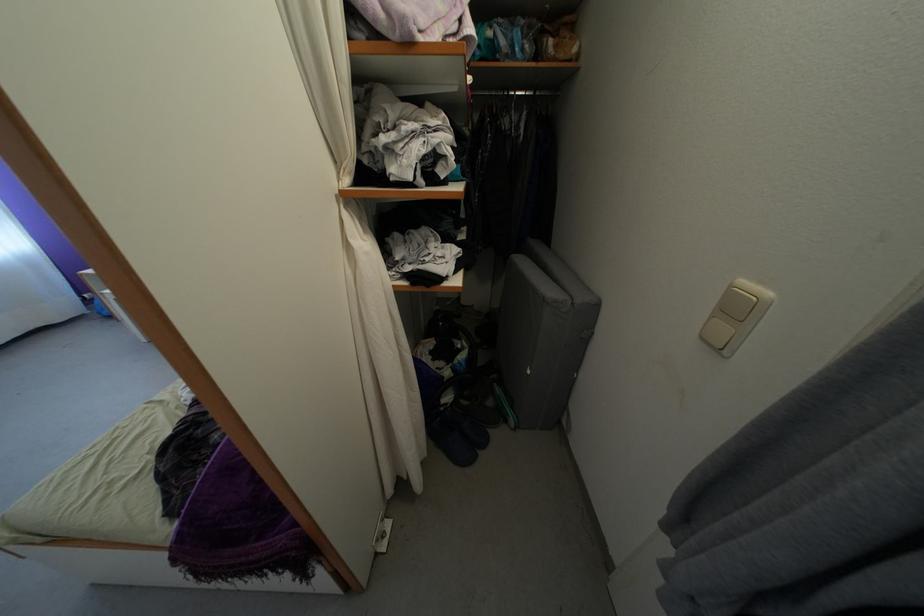
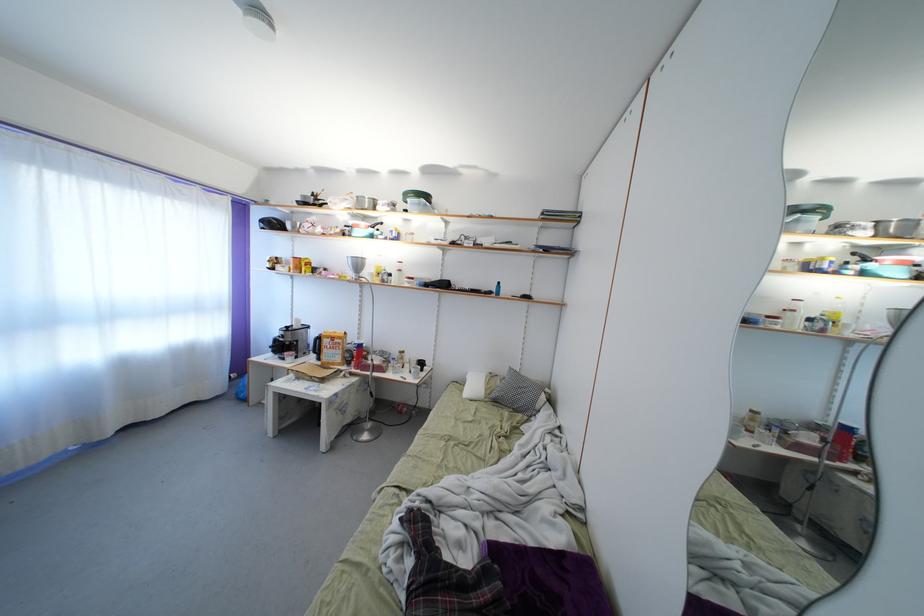
Question: Based on the continuous images, in which direction is the camera rotating? Reply with the corresponding letter.

Choices:
 (A) Left
 (B) Right
 (C) Up
 (D) Down

Answer: (C)